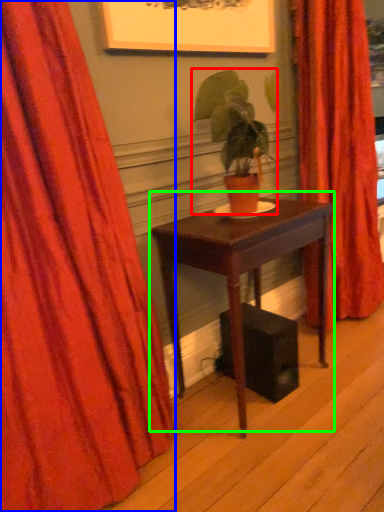
Question: Estimate the real-world distances between objects in this image. Which object is farther from houseplant (highlighted by a red box), curtain (highlighted by a blue box) or table (highlighted by a green box)?

Choices:
 (A) curtain
 (B) table

Answer: (A)